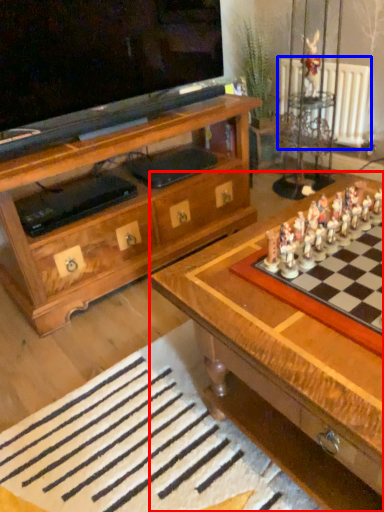
Question: Which object appears closest to the camera in this image, table (highlighted by a red box) or radiator (highlighted by a blue box)?

Choices:
 (A) table
 (B) radiator

Answer: (A)